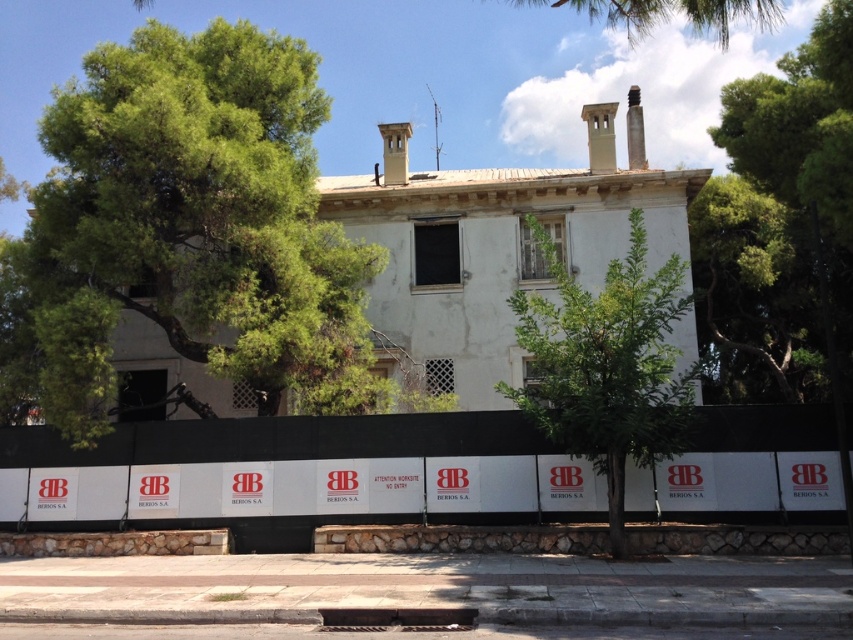
Between green leafy tree at upper right and green leafy tree at center, which one appears on the left side from the viewer's perspective?

green leafy tree at center

Which is more to the right, green leafy tree at upper right or green leafy tree at center?

From the viewer's perspective, green leafy tree at upper right appears more on the right side.

This screenshot has width=853, height=640. Describe the element at coordinates (779, 224) in the screenshot. I see `green leafy tree at upper right` at that location.

Where is `green leafy tree at upper right`? green leafy tree at upper right is located at coordinates (779, 224).

Is green leafy tree at upper right further to the viewer compared to green leafy tree at upper center?

No, it is not.

Is green leafy tree at upper right smaller than green leafy tree at upper center?

Yes, green leafy tree at upper right is smaller than green leafy tree at upper center.

The image size is (853, 640). In order to click on green leafy tree at upper right in this screenshot , I will do `click(779, 224)`.

Locate an element on the screen. The height and width of the screenshot is (640, 853). green leafy tree at upper right is located at coordinates (779, 224).

Looking at this image, is green leafy tree at left in front of green leafy tree at upper right?

No, it is behind green leafy tree at upper right.

This screenshot has height=640, width=853. Describe the element at coordinates (195, 225) in the screenshot. I see `green leafy tree at left` at that location.

This screenshot has width=853, height=640. I want to click on green leafy tree at left, so click(x=195, y=225).